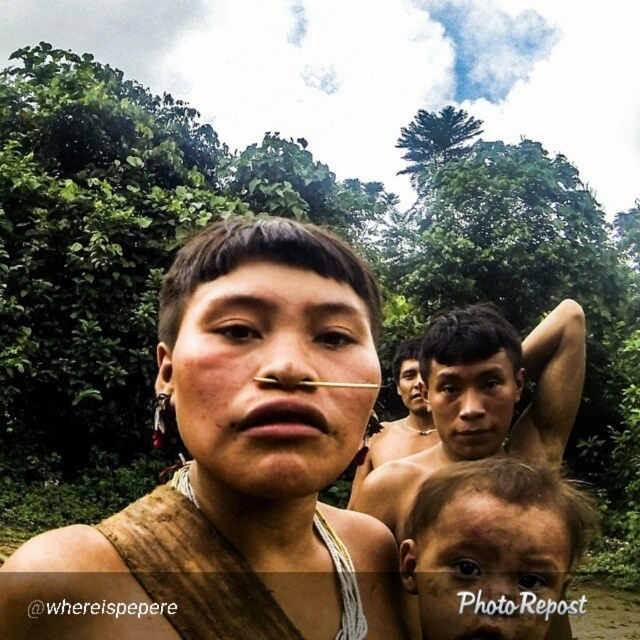
Between point (333, 420) and point (556, 461), which one is positioned in front?

Point (333, 420) is more forward.

Is the position of matte skin nose at center less distant than that of shiny metallic arm at upper right?

Yes, it is.

Image resolution: width=640 pixels, height=640 pixels. What are the coordinates of `matte skin nose at center` in the screenshot? It's located at (272, 380).

Who is higher up, brown leather strap at center or shiny metallic arm at upper right?

brown leather strap at center

You are a GUI agent. You are given a task and a screenshot of the screen. Output one action in this format:
    pyautogui.click(x=<x>, y=<y>)
    Task: Click on the brown leather strap at center
    Image resolution: width=640 pixels, height=640 pixels.
    Given the screenshot: What is the action you would take?
    pyautogui.click(x=237, y=464)

Is matte skin nose at center taller than smooth skin face at center?

No, matte skin nose at center is not taller than smooth skin face at center.

Between point (307, 300) and point (458, 400), which one is positioned behind?

Point (458, 400)

Where is `matte skin nose at center`? The image size is (640, 640). matte skin nose at center is located at coordinates (272, 380).